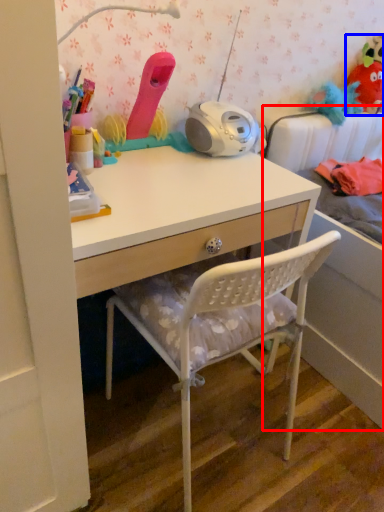
Question: Among these objects, which one is farthest to the camera, bed (highlighted by a red box) or toy (highlighted by a blue box)?

Choices:
 (A) bed
 (B) toy

Answer: (B)